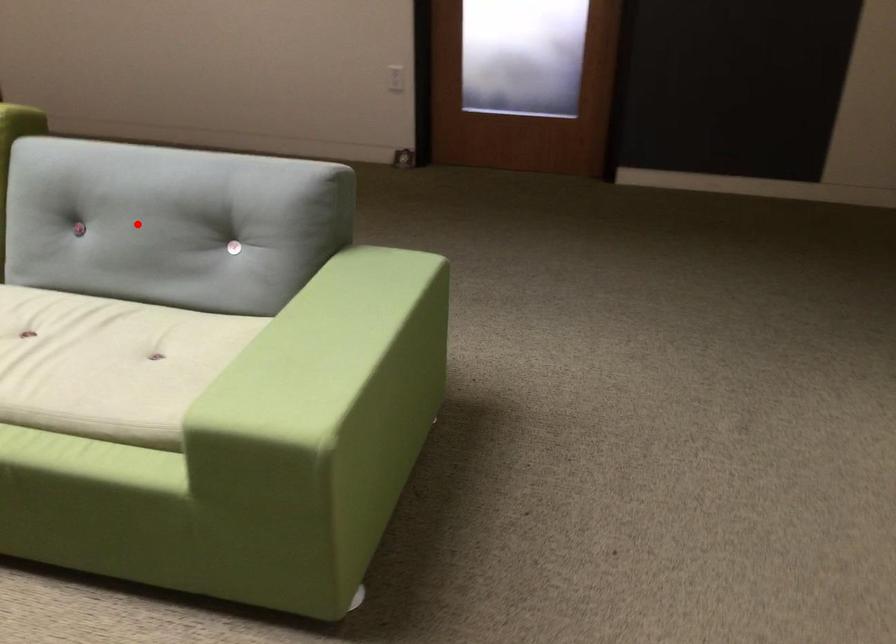
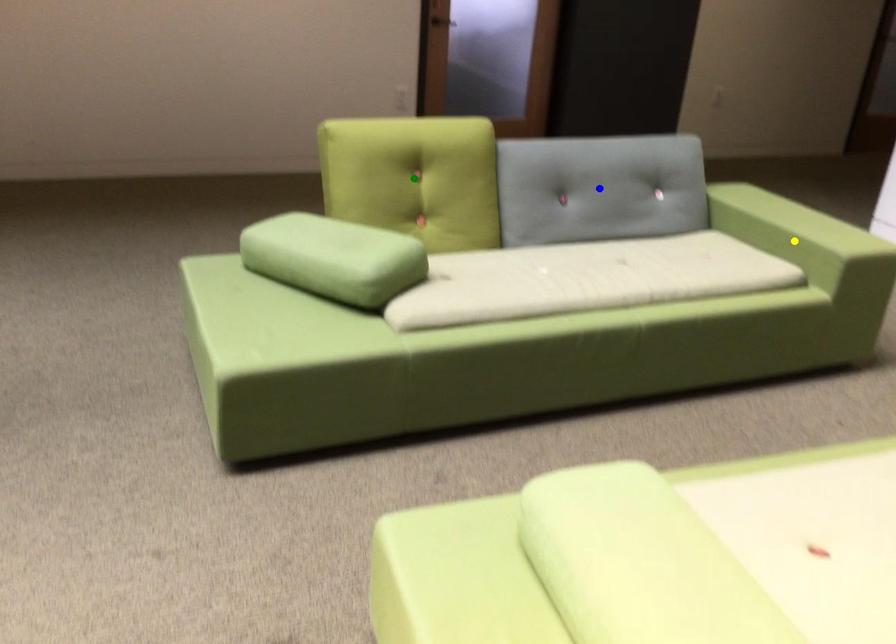
Question: I am providing you with two images of the same scene from different viewpoints. A red point is marked on the first image. You are given multiple points on the second image. Which point in image 2 represents the same 3d spot as the red point in image 1?

Choices:
 (A) blue point
 (B) green point
 (C) yellow point

Answer: (A)